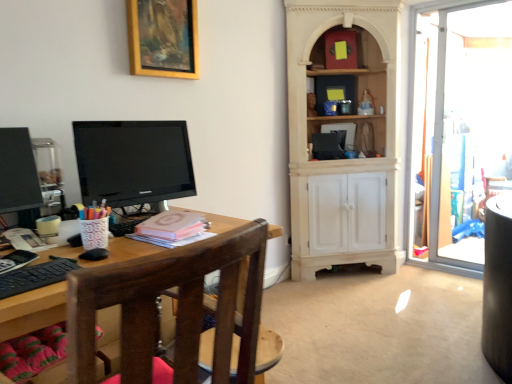
Question: Is point (133, 51) positioned closer to the camera than point (32, 193)?

Choices:
 (A) closer
 (B) farther

Answer: (B)

Question: From the image's perspective, is gold wooden picture frame at upper center above or below matte black monitor at left?

Choices:
 (A) above
 (B) below

Answer: (A)

Question: Which object is positioned closest to the matte black monitor at left?

Choices:
 (A) pink matte book at center
 (B) brown wooden chair at left
 (C) gold wooden picture frame at upper center
 (D) transparent glass door at right
 (E) matte black monitor at left

Answer: (A)

Question: Which object is positioned closest to the pink matte book at center?

Choices:
 (A) matte black monitor at left
 (B) brown wooden chair at left
 (C) matte black monitor at left
 (D) black textured keyboard at left
 (E) transparent glass door at right

Answer: (A)